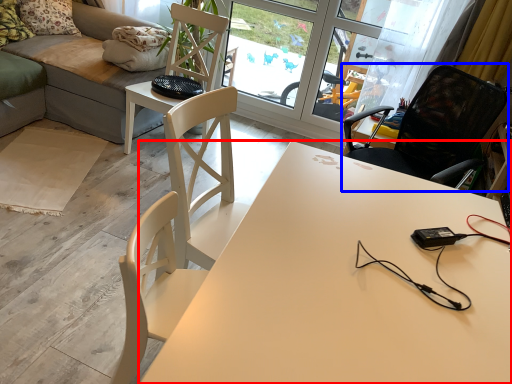
Question: Which object is further to the camera taking this photo, desk (highlighted by a red box) or chair (highlighted by a blue box)?

Choices:
 (A) desk
 (B) chair

Answer: (B)